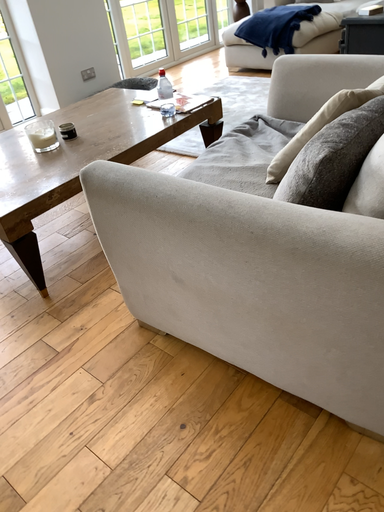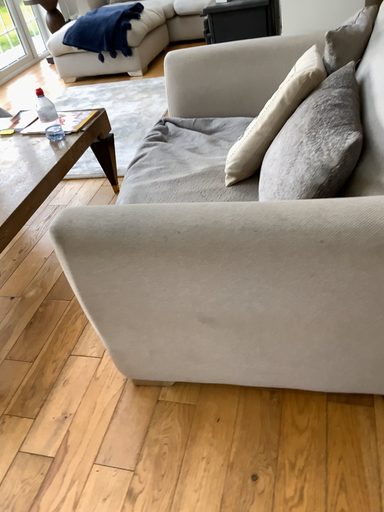
Question: How did the camera likely rotate when shooting the video?

Choices:
 (A) rotated left
 (B) rotated right

Answer: (B)